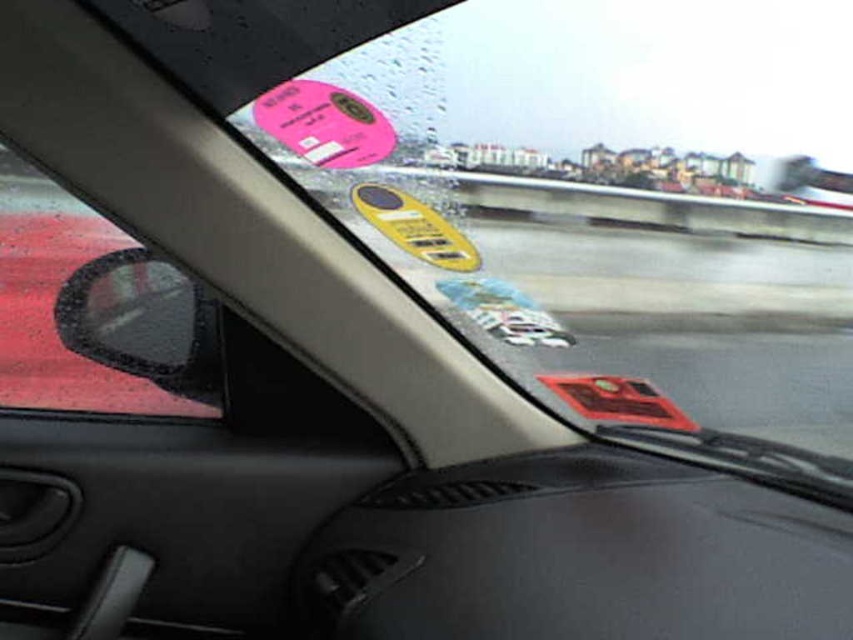
You are a passenger in the car and want to point out the pink glossy sticker at upper center and the yellow matte keychain at center to the driver. Which one of these two items is smaller in size?

The pink glossy sticker at upper center has a smaller size compared to the yellow matte keychain at center, so the pink glossy sticker at upper center is smaller.

You are a car inspector checking the windshield stickers. You notice the transparent rubber side mirror at left and the red matte sticker at center. Which object takes up more space on the windshield?

The red matte sticker at center takes up more space on the windshield than the transparent rubber side mirror at left because the transparent rubber side mirror at left occupies less space than red matte sticker at center.

You are a passenger in the car and want to know if the point at coordinate (86,256) is closer to the front of the car compared to the point at (424,216). Based on the windshield view, can you determine which point is closer to the front?

Point (86,256) is behind point (424,216), so the point at (424,216) is closer to the front of the car.